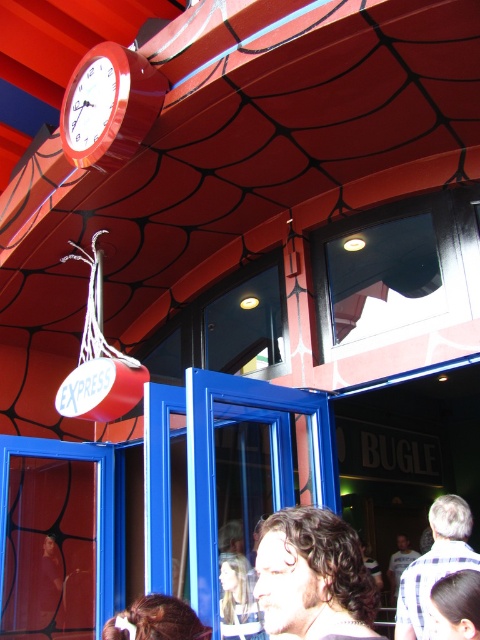
Question: Does transparent glass window at upper center lie behind transparent glass window at center?

Choices:
 (A) no
 (B) yes

Answer: (A)

Question: Which is farther from the shiny red clock at upper left?

Choices:
 (A) light brown hair at center
 (B) dark brown hair at center
 (C) dark curly hair at center

Answer: (A)

Question: Which point is farther from the camera taking this photo?

Choices:
 (A) (474, 609)
 (B) (173, 608)

Answer: (B)

Question: Can you confirm if dark curly hair at center is positioned below dark brown hair at lower center?

Choices:
 (A) yes
 (B) no

Answer: (B)

Question: Which of the following is the closest to the observer?

Choices:
 (A) (193, 614)
 (B) (456, 509)
 (C) (394, 589)
 (D) (207, 502)

Answer: (A)

Question: In this image, where is transparent glass window at upper center located relative to blue glass door at lower center?

Choices:
 (A) left
 (B) right

Answer: (B)